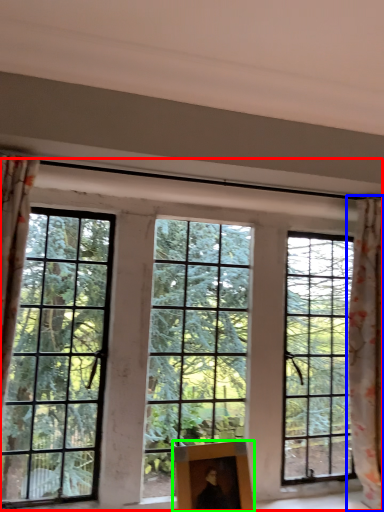
Question: Based on their relative distances, which object is farther from window (highlighted by a red box)? Choose from curtain (highlighted by a blue box) and picture frame (highlighted by a green box).

Choices:
 (A) curtain
 (B) picture frame

Answer: (A)